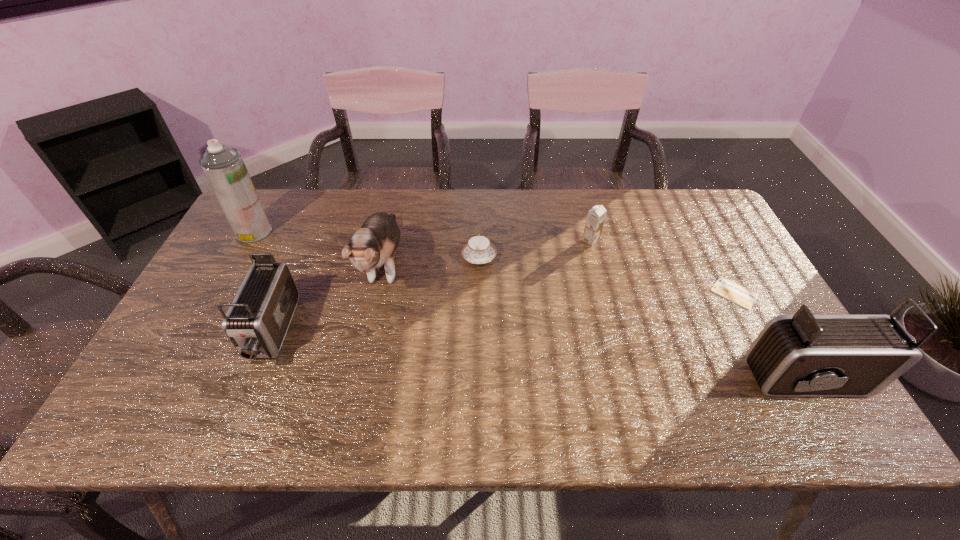
Where is `location for an additional camcorder to make spacing equal`? This screenshot has height=540, width=960. location for an additional camcorder to make spacing equal is located at coordinates (532, 354).